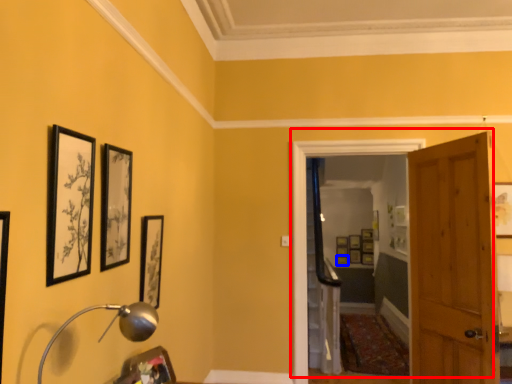
Question: Which object is further to the camera taking this photo, door (highlighted by a red box) or picture frame (highlighted by a blue box)?

Choices:
 (A) door
 (B) picture frame

Answer: (B)